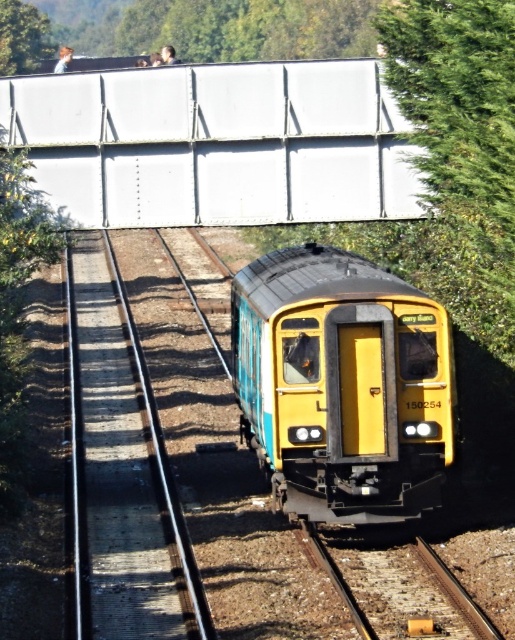
Consider the image. Does green leafy tree at upper center appear over metal/rough train track at lower center?

Yes, green leafy tree at upper center is above metal/rough train track at lower center.

Who is higher up, green leafy tree at upper center or metal/rough train track at lower center?

green leafy tree at upper center

Between point (178, 22) and point (467, 616), which one is positioned in front?

Point (467, 616)

Locate an element on the screen. This screenshot has width=515, height=640. green leafy tree at upper center is located at coordinates (248, 28).

Between yellow matte train at center and green leafy tree at upper left, which one is positioned lower?

yellow matte train at center is below.

Is point (309, 424) in front of point (3, 19)?

Yes.

Identify the location of yellow matte train at center. (342, 385).

Where is `yellow matte train at center`? yellow matte train at center is located at coordinates (342, 385).

Does smooth concrete train track at center lie in front of green leafy tree at upper left?

Yes, it is in front of green leafy tree at upper left.

Who is more forward, (77, 472) or (1, 20)?

Point (77, 472) is in front.

Where is `smooth concrete train track at center`? The image size is (515, 640). smooth concrete train track at center is located at coordinates (126, 467).